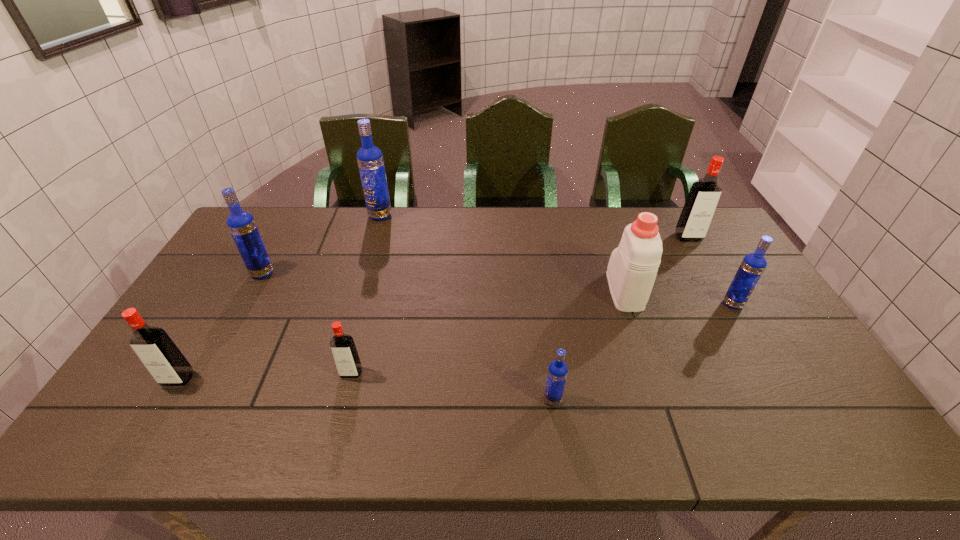
In order to click on the third blue vodka from right to left in this screenshot , I will do `click(370, 160)`.

This screenshot has width=960, height=540. Find the location of `the tallest object`. the tallest object is located at coordinates (370, 160).

Identify the location of the leftmost blue vodka. This screenshot has height=540, width=960. (241, 224).

The width and height of the screenshot is (960, 540). I want to click on the second biggest blue vodka, so click(241, 224).

Identify the location of the second farthest object. (699, 208).

The width and height of the screenshot is (960, 540). Identify the location of the rightmost red vodka. (699, 208).

The width and height of the screenshot is (960, 540). I want to click on detergent, so click(x=632, y=269).

This screenshot has height=540, width=960. Identify the location of the third object from right to left. (632, 269).

I want to click on the second smallest blue vodka, so click(x=753, y=265).

At what (x,y) coordinates should I click in order to perform the action: click on the rightmost blue vodka. Please return your answer as a coordinate pair (x, y). This screenshot has width=960, height=540. Looking at the image, I should click on (753, 265).